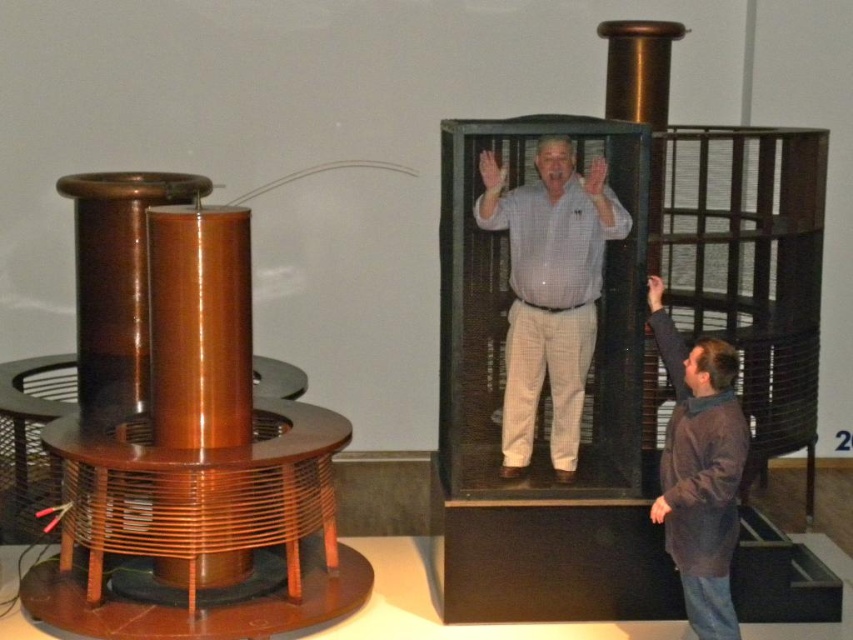
Question: Which point is closer to the camera?

Choices:
 (A) metallic grid cage at center
 (B) brown fuzzy sweater at lower right

Answer: (B)

Question: Is metallic grid cage at center to the left of light blue checkered shirt at center from the viewer's perspective?

Choices:
 (A) no
 (B) yes

Answer: (A)

Question: Is light blue checkered shirt at center in front of brown fuzzy sweater at lower right?

Choices:
 (A) yes
 (B) no

Answer: (B)

Question: Which point appears closest to the camera in this image?

Choices:
 (A) (x=670, y=508)
 (B) (x=512, y=230)
 (C) (x=677, y=280)

Answer: (A)

Question: Does metallic grid cage at center appear over light blue checkered shirt at center?

Choices:
 (A) yes
 (B) no

Answer: (B)

Question: Which point appears farthest from the camera in this image?

Choices:
 (A) (440, 273)
 (B) (666, 541)
 (C) (534, 394)

Answer: (A)